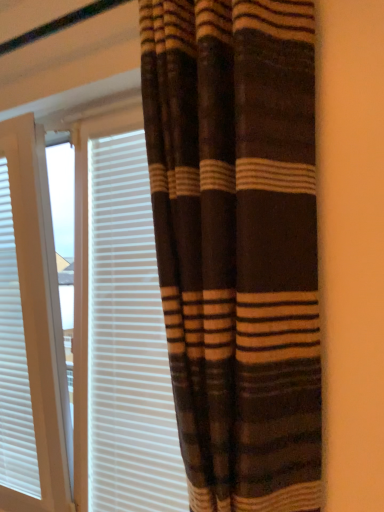
Question: Should I look upward or downward to see white textured blinds at left?

Choices:
 (A) up
 (B) down

Answer: (B)

Question: Does brown striped curtain at center contain white textured blinds at left?

Choices:
 (A) no
 (B) yes

Answer: (A)

Question: Considering the relative positions of brown striped curtain at center and white textured blinds at left in the image provided, is brown striped curtain at center in front of white textured blinds at left?

Choices:
 (A) yes
 (B) no

Answer: (A)

Question: Is brown striped curtain at center taller than white textured blinds at left?

Choices:
 (A) yes
 (B) no

Answer: (A)

Question: Is brown striped curtain at center behind white textured blinds at left?

Choices:
 (A) no
 (B) yes

Answer: (A)

Question: Can we say brown striped curtain at center lies outside white textured blinds at left?

Choices:
 (A) no
 (B) yes

Answer: (B)

Question: Is brown striped curtain at center with white textured blinds at left?

Choices:
 (A) no
 (B) yes

Answer: (A)

Question: Does brown striped curtain at center have a lesser height compared to white textured blinds at center?

Choices:
 (A) no
 (B) yes

Answer: (A)

Question: Is brown striped curtain at center far away from white textured blinds at center?

Choices:
 (A) no
 (B) yes

Answer: (A)

Question: From a real-world perspective, is brown striped curtain at center on top of white textured blinds at center?

Choices:
 (A) yes
 (B) no

Answer: (A)

Question: Could you tell me if brown striped curtain at center is turned towards white textured blinds at center?

Choices:
 (A) yes
 (B) no

Answer: (B)

Question: Considering the relative sizes of brown striped curtain at center and white textured blinds at center in the image provided, is brown striped curtain at center smaller than white textured blinds at center?

Choices:
 (A) yes
 (B) no

Answer: (B)

Question: Is brown striped curtain at center wider than white textured blinds at center?

Choices:
 (A) yes
 (B) no

Answer: (A)

Question: Can you confirm if white textured blinds at left is taller than white textured blinds at center?

Choices:
 (A) yes
 (B) no

Answer: (B)